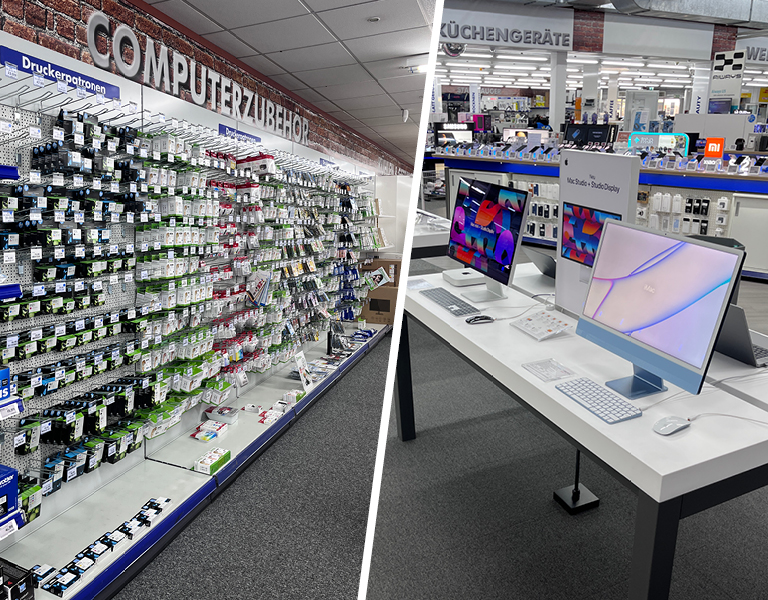
Locate an element on the screen. This screenshot has height=600, width=768. rug is located at coordinates (478, 564).